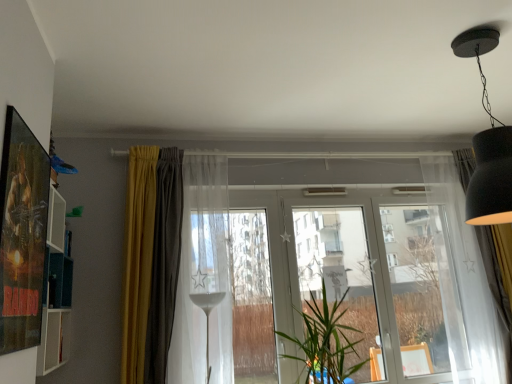
Question: Should I look upward or downward to see dark gray velvet curtain at center, which is the second curtain in left-to-right order?

Choices:
 (A) up
 (B) down

Answer: (B)

Question: From a real-world perspective, is transparent glass window at center beneath transparent glass window frame at center?

Choices:
 (A) yes
 (B) no

Answer: (A)

Question: From a real-world perspective, is transparent glass window at center on top of transparent glass window frame at center?

Choices:
 (A) no
 (B) yes

Answer: (A)

Question: Is transparent glass window at center closer to camera compared to transparent glass window frame at center?

Choices:
 (A) no
 (B) yes

Answer: (A)

Question: Considering the relative sizes of transparent glass window at center and transparent glass window frame at center in the image provided, is transparent glass window at center shorter than transparent glass window frame at center?

Choices:
 (A) no
 (B) yes

Answer: (B)

Question: Could you tell me if transparent glass window at center is facing transparent glass window frame at center?

Choices:
 (A) yes
 (B) no

Answer: (A)

Question: Is transparent glass window at center in contact with transparent glass window frame at center?

Choices:
 (A) yes
 (B) no

Answer: (B)

Question: Is matte black lampshade at upper right looking in the opposite direction of transparent glass window at center?

Choices:
 (A) no
 (B) yes

Answer: (A)

Question: Does matte black lampshade at upper right come in front of transparent glass window at center?

Choices:
 (A) yes
 (B) no

Answer: (A)

Question: Would you say matte black lampshade at upper right contains transparent glass window at center?

Choices:
 (A) no
 (B) yes

Answer: (A)

Question: Are matte black lampshade at upper right and transparent glass window at center beside each other?

Choices:
 (A) yes
 (B) no

Answer: (B)

Question: Considering the relative sizes of matte black lampshade at upper right and transparent glass window at center in the image provided, is matte black lampshade at upper right bigger than transparent glass window at center?

Choices:
 (A) yes
 (B) no

Answer: (B)

Question: Is matte black lampshade at upper right facing towards transparent glass window at center?

Choices:
 (A) no
 (B) yes

Answer: (A)

Question: Is transparent glass screen door at center, the 2th screen door when ordered from right to left, located within transparent glass window at center?

Choices:
 (A) yes
 (B) no

Answer: (A)